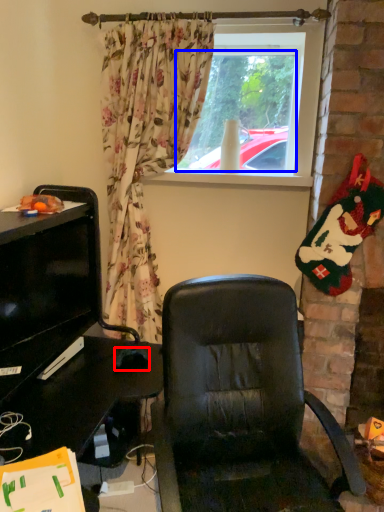
Question: Which object is further to the camera taking this photo, mouse (highlighted by a red box) or window screen (highlighted by a blue box)?

Choices:
 (A) mouse
 (B) window screen

Answer: (B)